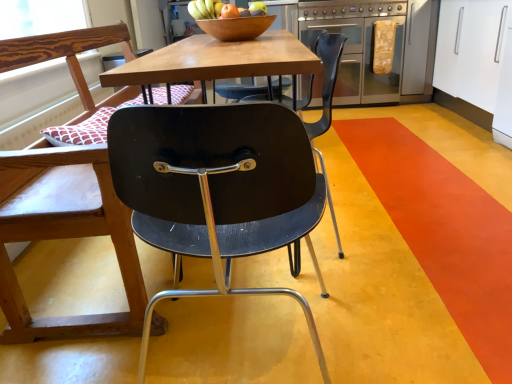
Question: Is matte black chair at center, the 1th chair viewed from the right, thinner than white glossy cabinet at upper right?

Choices:
 (A) yes
 (B) no

Answer: (A)

Question: Can you confirm if matte black chair at center, the 2th chair from the left, is smaller than white glossy cabinet at upper right?

Choices:
 (A) yes
 (B) no

Answer: (A)

Question: Does matte black chair at center, the 2th chair from the left, lie behind white glossy cabinet at upper right?

Choices:
 (A) no
 (B) yes

Answer: (A)

Question: Considering the relative sizes of matte black chair at center, the 1th chair viewed from the right, and white glossy cabinet at upper right in the image provided, is matte black chair at center, the 1th chair viewed from the right, taller than white glossy cabinet at upper right?

Choices:
 (A) no
 (B) yes

Answer: (A)

Question: Is matte black chair at center, the 2th chair from the left, completely or partially outside of white glossy cabinet at upper right?

Choices:
 (A) no
 (B) yes

Answer: (B)

Question: Would you say wooden bowl at center is inside or outside matte brown apple at center?

Choices:
 (A) inside
 (B) outside

Answer: (B)

Question: Would you say wooden bowl at center is to the left or to the right of matte brown apple at center in the picture?

Choices:
 (A) right
 (B) left

Answer: (B)

Question: From their relative heights in the image, would you say wooden bowl at center is taller or shorter than matte brown apple at center?

Choices:
 (A) tall
 (B) short

Answer: (A)

Question: From a real-world perspective, is wooden bowl at center physically located above or below matte brown apple at center?

Choices:
 (A) below
 (B) above

Answer: (A)

Question: Is point pyautogui.click(x=355, y=102) positioned closer to the camera than point pyautogui.click(x=246, y=38)?

Choices:
 (A) farther
 (B) closer

Answer: (A)

Question: Would you say stainless steel oven at center right is inside or outside wooden bowl at center?

Choices:
 (A) inside
 (B) outside

Answer: (B)

Question: Is stainless steel oven at center right bigger or smaller than wooden bowl at center?

Choices:
 (A) small
 (B) big

Answer: (B)

Question: Considering the positions of stainless steel oven at center right and wooden bowl at center in the image, is stainless steel oven at center right wider or thinner than wooden bowl at center?

Choices:
 (A) wide
 (B) thin

Answer: (A)

Question: Is wooden bowl at center inside the boundaries of matte black chair at left, which appears as the first chair when viewed from the left, or outside?

Choices:
 (A) outside
 (B) inside

Answer: (A)

Question: In terms of height, does wooden bowl at center look taller or shorter compared to matte black chair at left, which is counted as the 2th chair, starting from the right?

Choices:
 (A) tall
 (B) short

Answer: (B)